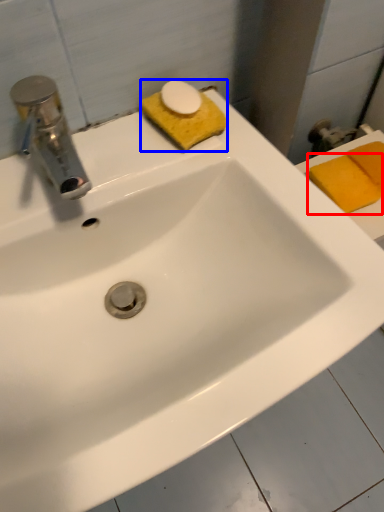
Question: Which object appears farthest to the camera in this image, soap (highlighted by a red box) or soap (highlighted by a blue box)?

Choices:
 (A) soap
 (B) soap

Answer: (A)